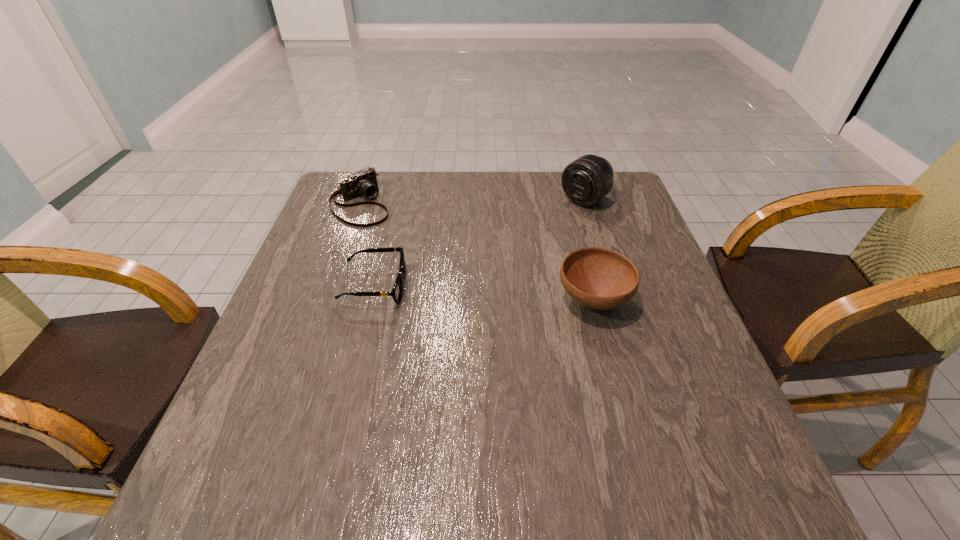
Where is `free space on the desktop that is between the sunglasses and the third shortest object and is positioned on the front-facing side of the camera`? free space on the desktop that is between the sunglasses and the third shortest object and is positioned on the front-facing side of the camera is located at coordinates (464, 292).

Locate an element on the screen. This screenshot has width=960, height=540. vacant space on the desktop that is between the shortest object and the bowl and is positioned on the front-facing side of the tallest object is located at coordinates (462, 292).